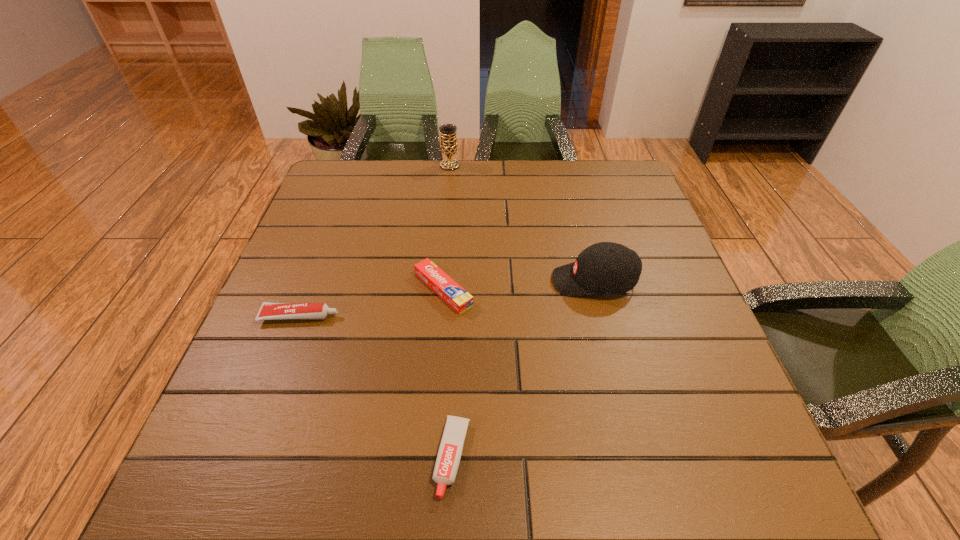
The width and height of the screenshot is (960, 540). I want to click on blank space at the near left corner of the desktop, so click(225, 505).

You are a GUI agent. You are given a task and a screenshot of the screen. Output one action in this format:
    pyautogui.click(x=<x>, y=<y>)
    Task: Click on the vacant space at the far right corner
    
    Given the screenshot: What is the action you would take?
    pyautogui.click(x=587, y=179)

You are a GUI agent. You are given a task and a screenshot of the screen. Output one action in this format:
    pyautogui.click(x=<x>, y=<y>)
    Task: Click on the free location at the near right corner
    This screenshot has width=960, height=540.
    Given the screenshot: What is the action you would take?
    pyautogui.click(x=701, y=499)

Find the location of a particular element. vacant area that lies between the baseball cap and the nearest toothpaste is located at coordinates (523, 369).

At what (x,y) coordinates should I click in order to perform the action: click on free space between the nearest object and the tallest object. Please return your answer as a coordinate pair (x, y). The image size is (960, 540). Looking at the image, I should click on (451, 312).

You are a GUI agent. You are given a task and a screenshot of the screen. Output one action in this format:
    pyautogui.click(x=<x>, y=<y>)
    Task: Click on the free area in between the leftmost object and the nearest toothpaste
    The width and height of the screenshot is (960, 540).
    Given the screenshot: What is the action you would take?
    pyautogui.click(x=376, y=387)

Where is `vacant area that lies between the leftmost toothpaste and the nearest object`? This screenshot has width=960, height=540. vacant area that lies between the leftmost toothpaste and the nearest object is located at coordinates (376, 387).

Locate an element on the screen. This screenshot has width=960, height=540. free space between the nearest object and the second tallest object is located at coordinates (523, 369).

At what (x,y) coordinates should I click in order to perform the action: click on the closest object relative to the nearest object. Please return your answer as a coordinate pair (x, y). The width and height of the screenshot is (960, 540). Looking at the image, I should click on 452,293.

The height and width of the screenshot is (540, 960). I want to click on object that stands as the second closest to the tallest object, so pos(608,268).